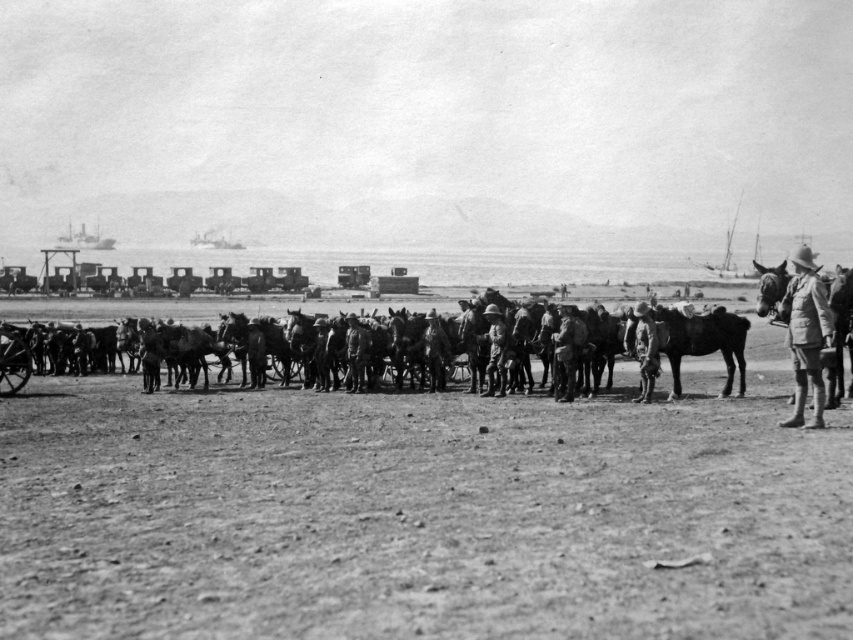
Which is behind, point (599, 580) or point (637, 317)?

The point (637, 317) is more distant.

Who is more forward, (x=314, y=636) or (x=650, y=381)?

Point (x=314, y=636)

You are a GUI agent. You are given a task and a screenshot of the screen. Output one action in this format:
    pyautogui.click(x=<x>, y=<y>)
    Task: Click on the dirt field at center
    
    Given the screenshot: What is the action you would take?
    pyautogui.click(x=422, y=515)

Which is more to the right, khaki uniform at center or camouflage fabric uniform at center?

khaki uniform at center

Does point (813, 292) lie in front of point (648, 349)?

That is True.

At what (x,y) coordinates should I click in order to perform the action: click on khaki uniform at center. Please return your answer as a coordinate pair (x, y). Looking at the image, I should click on (805, 336).

Is dirt field at center to the right of khaki uniform at center from the viewer's perspective?

In fact, dirt field at center is to the left of khaki uniform at center.

Who is higher up, dirt field at center or khaki uniform at center?

khaki uniform at center is above.

The height and width of the screenshot is (640, 853). Describe the element at coordinates (422, 515) in the screenshot. I see `dirt field at center` at that location.

Find the location of a particular element. The image size is (853, 640). dirt field at center is located at coordinates (422, 515).